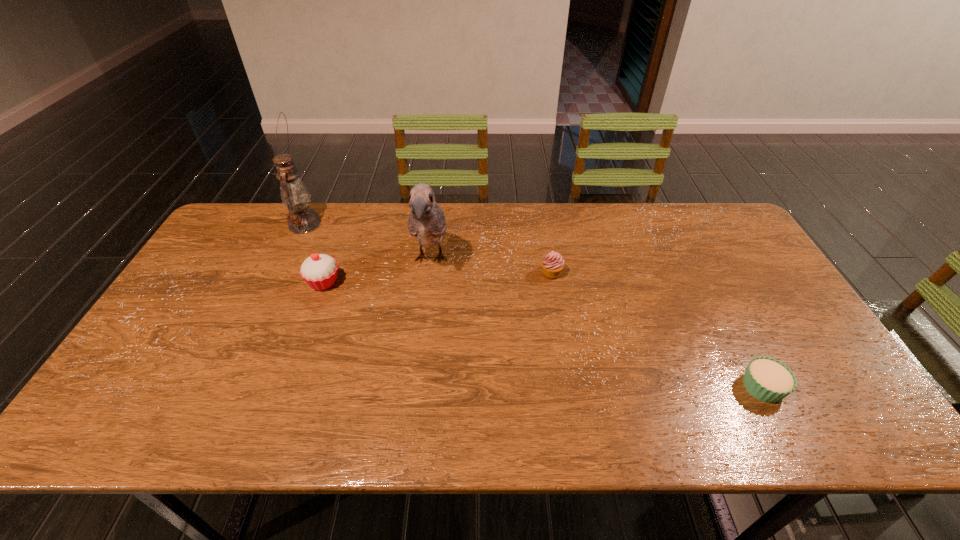
Locate an element on the screen. empty location between the fourth tallest object and the shortest object is located at coordinates (658, 330).

Locate an element on the screen. The image size is (960, 540). vacant space in between the tallest cupcake and the oil lamp is located at coordinates (314, 253).

Identify the location of vacant space that's between the leftmost cupcake and the rightmost cupcake. (543, 335).

Identify the location of free space between the second object from left to right and the nearest object. (543, 335).

Where is `free point between the rightmost cupcake and the third object from left to right`? The image size is (960, 540). free point between the rightmost cupcake and the third object from left to right is located at coordinates (597, 323).

Identify which object is located as the second nearest to the tallest object. Please provide its 2D coordinates. Your answer should be formatted as a tuple, i.e. [(x, y)], where the tuple contains the x and y coordinates of a point satisfying the conditions above.

[(426, 222)]

Identify which object is the nearest to the second cupcake from right to left. Please provide its 2D coordinates. Your answer should be formatted as a tuple, i.e. [(x, y)], where the tuple contains the x and y coordinates of a point satisfying the conditions above.

[(426, 222)]

Where is `cupcake that is the second closest to the nearest object`? cupcake that is the second closest to the nearest object is located at coordinates (319, 271).

You are a GUI agent. You are given a task and a screenshot of the screen. Output one action in this format:
    pyautogui.click(x=<x>, y=<y>)
    Task: Click on the closest cupcake to the shortest object
    
    Given the screenshot: What is the action you would take?
    pyautogui.click(x=553, y=264)

Where is `vacant point that satisfies the following two spatial constraints: 1. on the front-facing side of the third object from left to right; 2. on the right side of the nearest cupcake`? The width and height of the screenshot is (960, 540). vacant point that satisfies the following two spatial constraints: 1. on the front-facing side of the third object from left to right; 2. on the right side of the nearest cupcake is located at coordinates (416, 387).